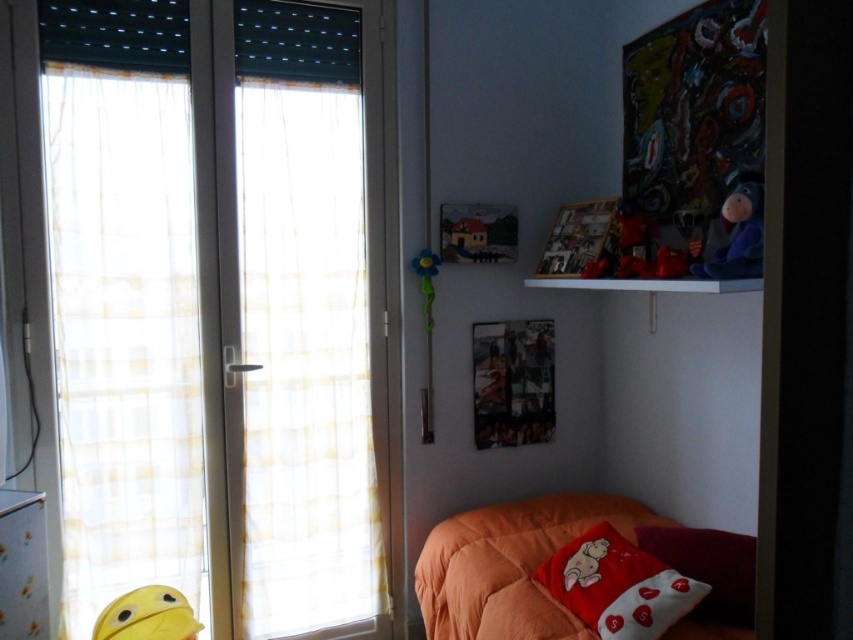
Does velvety blue plush at upper right appear on the left side of yellow plush toy at lower left?

In fact, velvety blue plush at upper right is to the right of yellow plush toy at lower left.

Based on the photo, which is below, velvety blue plush at upper right or yellow plush toy at lower left?

yellow plush toy at lower left

The width and height of the screenshot is (853, 640). Describe the element at coordinates (738, 234) in the screenshot. I see `velvety blue plush at upper right` at that location.

What are the coordinates of `velvety blue plush at upper right` in the screenshot? It's located at (738, 234).

Does orange quilted bed at lower right lie in front of white cotton pillow at lower right?

Yes, orange quilted bed at lower right is in front of white cotton pillow at lower right.

Which is behind, point (561, 616) or point (694, 550)?

Point (694, 550)

Is point (492, 570) positioned in front of point (654, 548)?

No, (492, 570) is behind (654, 548).

Where is `orange quilted bed at lower right`? This screenshot has height=640, width=853. orange quilted bed at lower right is located at coordinates (511, 564).

Who is positioned more to the left, white translucent glass door at left or white glossy dresser at lower left?

From the viewer's perspective, white glossy dresser at lower left appears more on the left side.

Between white translucent glass door at left and white glossy dresser at lower left, which one appears on the right side from the viewer's perspective?

From the viewer's perspective, white translucent glass door at left appears more on the right side.

Which is behind, point (76, 97) or point (47, 598)?

Positioned behind is point (76, 97).

The height and width of the screenshot is (640, 853). What are the coordinates of `white translucent glass door at left` in the screenshot? It's located at (225, 308).